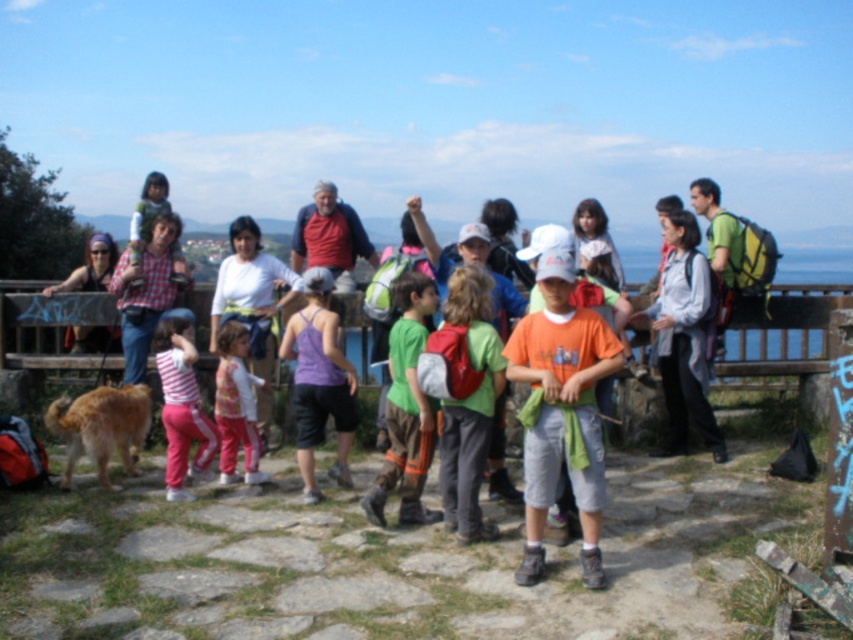
Can you confirm if green matte shirt at center is positioned below striped cotton shirt at center?

Actually, green matte shirt at center is above striped cotton shirt at center.

Between green matte shirt at center and striped cotton shirt at center, which one appears on the left side from the viewer's perspective?

Positioned to the left is striped cotton shirt at center.

Identify the location of green matte shirt at center. (405, 406).

This screenshot has width=853, height=640. I want to click on green matte shirt at center, so click(405, 406).

Between green matte backpack at center and matte plaid shirt at center, which one appears on the right side from the viewer's perspective?

Positioned to the right is green matte backpack at center.

Between green matte backpack at center and matte plaid shirt at center, which one appears on the left side from the viewer's perspective?

matte plaid shirt at center is more to the left.

Where is `green matte backpack at center`? The height and width of the screenshot is (640, 853). green matte backpack at center is located at coordinates (469, 403).

You are a GUI agent. You are given a task and a screenshot of the screen. Output one action in this format:
    pyautogui.click(x=<x>, y=<y>)
    Task: Click on the green matte backpack at center
    This screenshot has width=853, height=640.
    Given the screenshot: What is the action you would take?
    pyautogui.click(x=469, y=403)

Looking at this image, can you confirm if purple fabric tank top at center is thinner than matte black sunglasses at center?

No, purple fabric tank top at center is not thinner than matte black sunglasses at center.

This screenshot has width=853, height=640. Describe the element at coordinates (318, 381) in the screenshot. I see `purple fabric tank top at center` at that location.

Which is behind, point (316, 388) or point (82, 289)?

The point (82, 289) is more distant.

I want to click on purple fabric tank top at center, so [x=318, y=381].